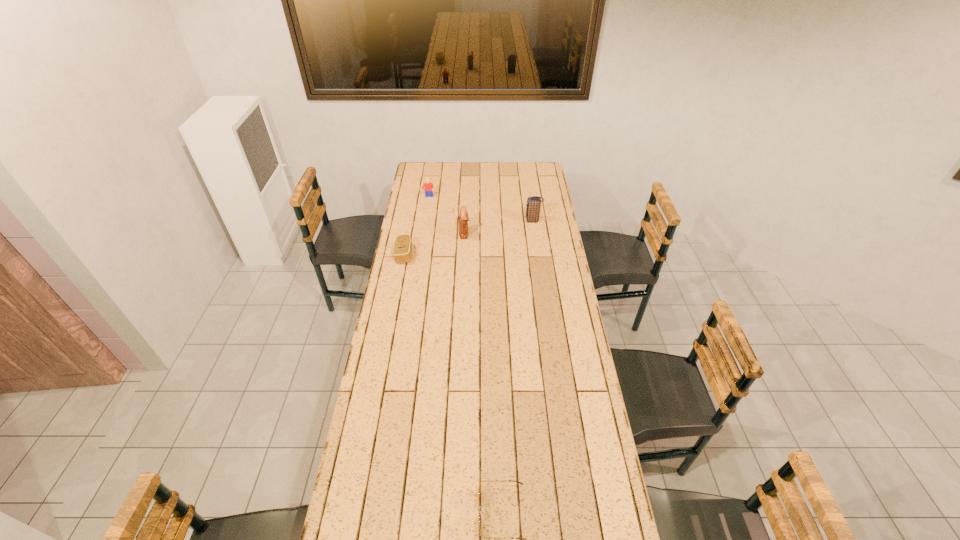
Locate an element on the screen. the rightmost clutch bag is located at coordinates (x=533, y=203).

Where is `the second farthest object`? The width and height of the screenshot is (960, 540). the second farthest object is located at coordinates (533, 203).

Locate an element on the screen. the third object from left to right is located at coordinates [463, 216].

Identify the location of the third farthest object. (463, 216).

The width and height of the screenshot is (960, 540). What are the coordinates of `Lego` in the screenshot? It's located at (429, 188).

Where is `the nearest clutch bag`? the nearest clutch bag is located at coordinates (402, 250).

The width and height of the screenshot is (960, 540). Identify the location of the leftmost clutch bag. (402, 250).

Locate an element on the screen. vacant space situated 0.350m with the zip open on the farthest clutch bag is located at coordinates (458, 221).

At what (x,y) coordinates should I click in order to perform the action: click on free space located 0.060m with the zip open on the farthest clutch bag. Please return your answer as a coordinate pair (x, y). Looking at the image, I should click on (513, 221).

Where is `blank space located with the zip open on the farthest clutch bag`? blank space located with the zip open on the farthest clutch bag is located at coordinates (471, 221).